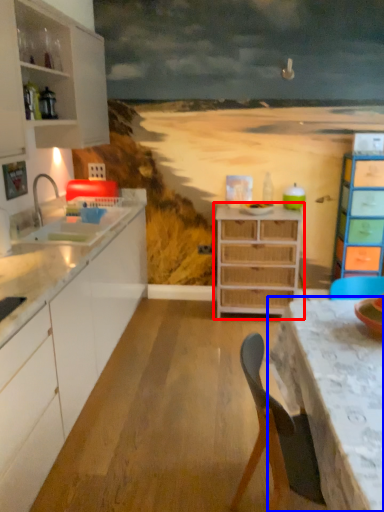
Question: Among these objects, which one is nearest to the camera, chest of drawers (highlighted by a red box) or table (highlighted by a blue box)?

Choices:
 (A) chest of drawers
 (B) table

Answer: (B)